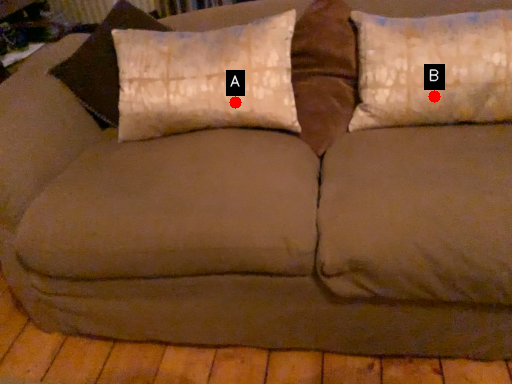
Question: Two points are circled on the image, labeled by A and B beside each circle. Which point is closer to the camera taking this photo?

Choices:
 (A) A is closer
 (B) B is closer

Answer: (B)